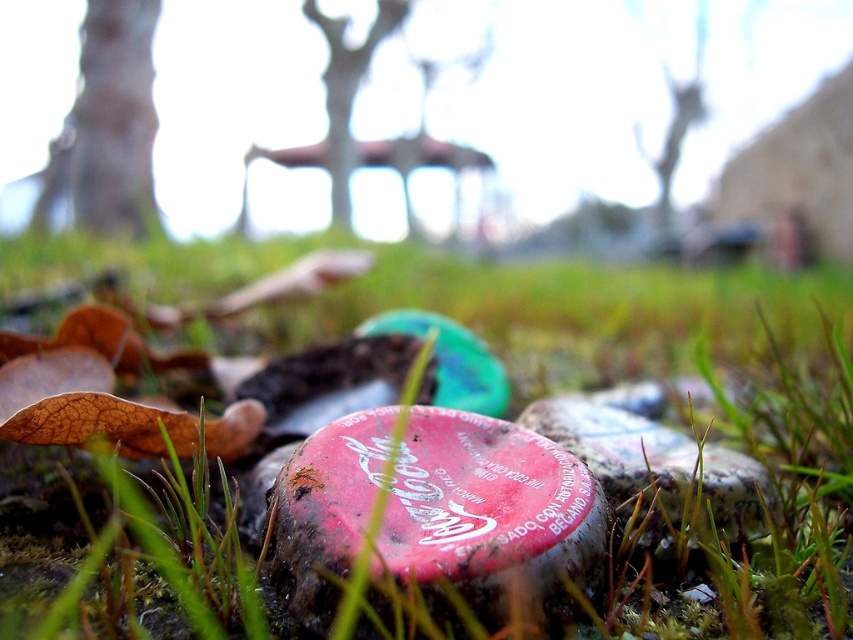
Can you confirm if smooth bark tree trunk at upper left is smaller than green matte tree at upper center?

Incorrect, smooth bark tree trunk at upper left is not smaller in size than green matte tree at upper center.

Does point (137, 150) lie in front of point (659, 154)?

Yes, it is in front of point (659, 154).

The image size is (853, 640). In order to click on smooth bark tree trunk at upper left in this screenshot , I will do `click(107, 125)`.

Where is `smooth bark tree trunk at upper left`? smooth bark tree trunk at upper left is located at coordinates (107, 125).

Which is in front, point (276, 467) or point (685, 477)?

Positioned in front is point (685, 477).

Who is positioned more to the left, green grass at center or speckled stone at center?

Positioned to the left is green grass at center.

Image resolution: width=853 pixels, height=640 pixels. What do you see at coordinates (184, 468) in the screenshot? I see `green grass at center` at bounding box center [184, 468].

At what (x,y) coordinates should I click in order to perform the action: click on green grass at center. Please return your answer as a coordinate pair (x, y). The height and width of the screenshot is (640, 853). Looking at the image, I should click on (184, 468).

Which of these two, green grass at center or rubberized red cap at center, stands shorter?

With less height is rubberized red cap at center.

Is green grass at center closer to the viewer compared to rubberized red cap at center?

Yes, green grass at center is closer to the viewer.

Which is in front, point (122, 387) or point (392, 408)?

Point (392, 408)

This screenshot has width=853, height=640. I want to click on green grass at center, so [184, 468].